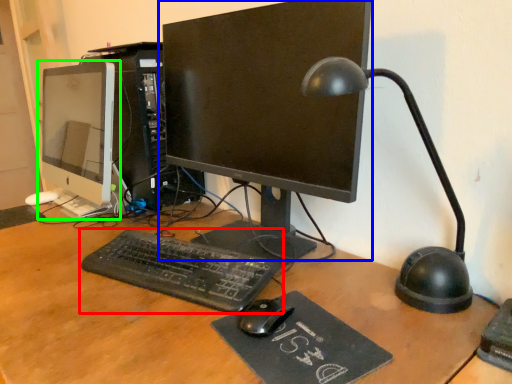
Question: Which is nearer to the computer keyboard (highlighted by a red box)? computer monitor (highlighted by a blue box) or computer monitor (highlighted by a green box).

Choices:
 (A) computer monitor
 (B) computer monitor

Answer: (A)